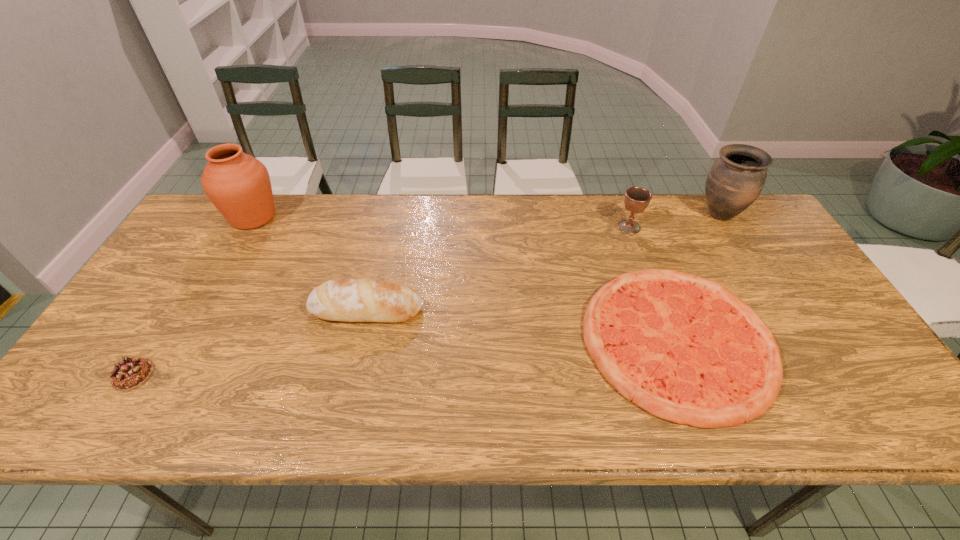
You are a GUI agent. You are given a task and a screenshot of the screen. Output one action in this format:
    pyautogui.click(x=<x>, y=<y>)
    Task: Click on the left urn
    Image resolution: width=960 pixels, height=540 pixels.
    Given the screenshot: What is the action you would take?
    pyautogui.click(x=239, y=186)

I want to click on the right urn, so click(x=735, y=180).

Identify the location of chalice. This screenshot has height=540, width=960. (636, 199).

Where is `bread`? This screenshot has width=960, height=540. bread is located at coordinates (352, 300).

Where is `the fourth object from right to left`? This screenshot has height=540, width=960. the fourth object from right to left is located at coordinates coord(352,300).

In order to click on chocolate cake in this screenshot , I will do `click(129, 374)`.

In order to click on the shortest object in this screenshot , I will do `click(685, 349)`.

Locate an element on the screen. Image resolution: width=960 pixels, height=540 pixels. vacant area located 0.360m on the front of the left urn is located at coordinates (188, 329).

You are a GUI agent. You are given a task and a screenshot of the screen. Output one action in this format:
    pyautogui.click(x=<x>, y=<y>)
    Task: Click on the free space located on the front of the right urn
    
    Given the screenshot: What is the action you would take?
    pyautogui.click(x=773, y=303)

Find the location of a particular element. vacant space located 0.170m on the left of the third tallest object is located at coordinates (563, 227).